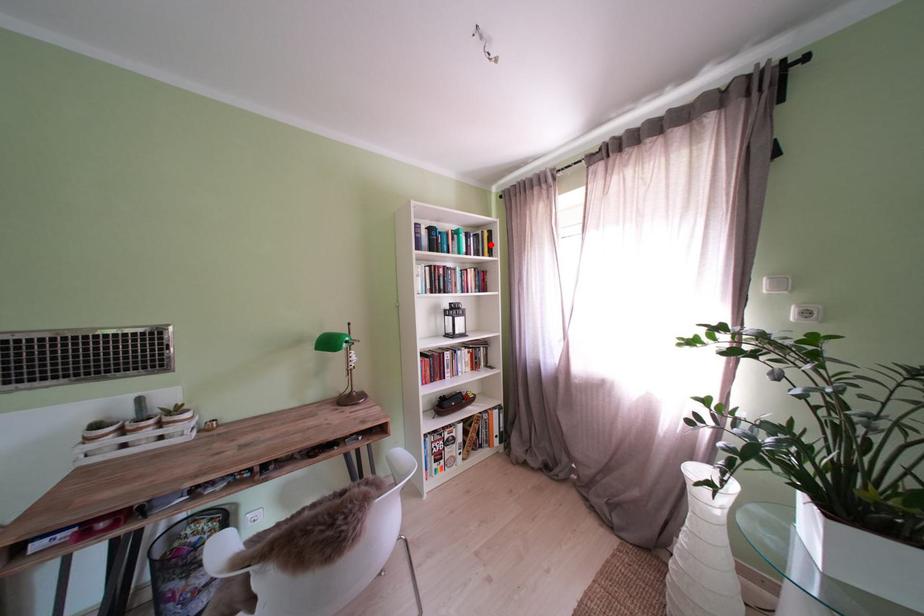
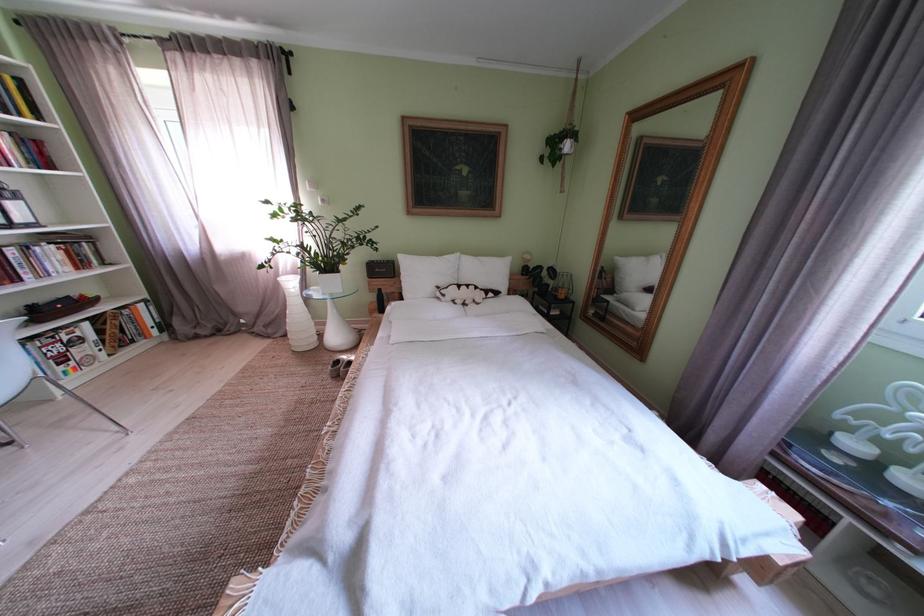
Locate, in the second image, the point that corresponds to the highlighted location in the first image.

(9, 92)